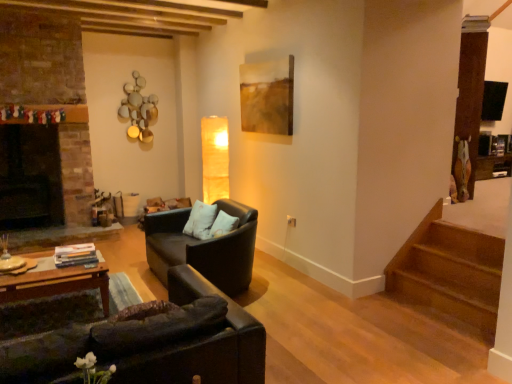
What are the coordinates of `matte black couch at center, positioned as the 1th studio couch in back-to-front order` in the screenshot? It's located at (204, 247).

In order to face matte black couch at center, positioned as the 1th studio couch in back-to-front order, should I rotate leftwards or rightwards?

It's best to rotate left around 7.034 degrees.

In order to face wooden coffee table at lower left, should I rotate leftwards or rightwards?

To face it directly, rotate left by 25.501 degrees.

Measure the distance between point (262, 85) and camera.

14.80 feet.

The height and width of the screenshot is (384, 512). Describe the element at coordinates (200, 220) in the screenshot. I see `white soft pillow at center` at that location.

The image size is (512, 384). I want to click on white soft pillow at center, so click(200, 220).

What are the coordinates of `matte black couch at center, the second studio couch viewed from the front` in the screenshot? It's located at (204, 247).

Is matte brown painting at upper center outside of white soft pillow at center?

Yes, matte brown painting at upper center is outside of white soft pillow at center.

Consider the image. Considering the relative sizes of matte brown painting at upper center and white soft pillow at center in the image provided, is matte brown painting at upper center thinner than white soft pillow at center?

Indeed, matte brown painting at upper center has a lesser width compared to white soft pillow at center.

Based on the photo, from a real-world perspective, is matte brown painting at upper center physically above white soft pillow at center?

Yes, from a real-world perspective, matte brown painting at upper center is over white soft pillow at center

Looking at this image, considering the relative positions of matte brown painting at upper center and white soft pillow at center in the image provided, is matte brown painting at upper center to the right of white soft pillow at center from the viewer's perspective?

Yes, matte brown painting at upper center is to the right of white soft pillow at center.

From the picture: From the image's perspective, is matte brown painting at upper center over black leather couch at lower left, marked as the 2th studio couch in a back-to-front arrangement?

Yes, from the image's perspective, matte brown painting at upper center is on top of black leather couch at lower left, marked as the 2th studio couch in a back-to-front arrangement.

Is the surface of matte brown painting at upper center in direct contact with black leather couch at lower left, marked as the 2th studio couch in a back-to-front arrangement?

No, matte brown painting at upper center is not in contact with black leather couch at lower left, marked as the 2th studio couch in a back-to-front arrangement.

Is matte brown painting at upper center bigger than black leather couch at lower left, marked as the 2th studio couch in a back-to-front arrangement?

No, matte brown painting at upper center is not bigger than black leather couch at lower left, marked as the 2th studio couch in a back-to-front arrangement.

Looking at this image, considering the relative sizes of matte black couch at center, the second studio couch viewed from the front, and matte brown painting at upper center in the image provided, is matte black couch at center, the second studio couch viewed from the front, wider than matte brown painting at upper center?

Correct, the width of matte black couch at center, the second studio couch viewed from the front, exceeds that of matte brown painting at upper center.

From a real-world perspective, which is physically above, matte black couch at center, positioned as the 1th studio couch in back-to-front order, or matte brown painting at upper center?

matte brown painting at upper center.

Is point (166, 234) in front of point (290, 102)?

Yes, point (166, 234) is closer to viewer.

Considering the relative positions of matte black couch at center, the second studio couch viewed from the front, and matte brown painting at upper center in the image provided, is matte black couch at center, the second studio couch viewed from the front, to the right of matte brown painting at upper center from the viewer's perspective?

No, matte black couch at center, the second studio couch viewed from the front, is not to the right of matte brown painting at upper center.

Identify the location of picture frame that appears above the white soft pillow at center (from the image's perspective). The width and height of the screenshot is (512, 384). (267, 96).

Visually, is white soft pillow at center positioned to the left or to the right of matte brown painting at upper center?

white soft pillow at center is positioned on matte brown painting at upper center's left side.

Is white soft pillow at center shorter than matte brown painting at upper center?

Yes, white soft pillow at center is shorter than matte brown painting at upper center.

From the image's perspective, is white soft pillow at center located above or below matte brown painting at upper center?

Based on their image positions, white soft pillow at center is located beneath matte brown painting at upper center.

Is wooden coffee table at lower left bigger than black leather couch at lower left, marked as the 2th studio couch in a back-to-front arrangement?

Actually, wooden coffee table at lower left might be smaller than black leather couch at lower left, marked as the 2th studio couch in a back-to-front arrangement.

From a real-world perspective, is wooden coffee table at lower left physically above black leather couch at lower left, which ranks as the first studio couch in front-to-back order?

No, from a real-world perspective, wooden coffee table at lower left is not over black leather couch at lower left, which ranks as the first studio couch in front-to-back order

Could you tell me if wooden coffee table at lower left is facing black leather couch at lower left, marked as the 2th studio couch in a back-to-front arrangement?

No, wooden coffee table at lower left is not turned towards black leather couch at lower left, marked as the 2th studio couch in a back-to-front arrangement.

How many degrees apart are the facing directions of wooden coffee table at lower left and black leather couch at lower left, marked as the 2th studio couch in a back-to-front arrangement?

2.04 degrees.

In the scene shown: From the image's perspective, who appears lower, wooden coffee table at lower left or matte black couch at center, the second studio couch viewed from the front?

wooden coffee table at lower left appears lower in the image.

Considering the relative sizes of wooden coffee table at lower left and matte black couch at center, the second studio couch viewed from the front, in the image provided, is wooden coffee table at lower left taller than matte black couch at center, the second studio couch viewed from the front,?

No.

Which is farther from the camera, (5, 286) or (179, 225)?

The point (179, 225) is farther from the camera.

Does wooden coffee table at lower left touch matte black couch at center, positioned as the 1th studio couch in back-to-front order?

No, wooden coffee table at lower left is not touching matte black couch at center, positioned as the 1th studio couch in back-to-front order.

Considering the positions of objects white soft pillow at center and wooden coffee table at lower left in the image provided, who is more to the left, white soft pillow at center or wooden coffee table at lower left?

From the viewer's perspective, wooden coffee table at lower left appears more on the left side.

Considering the sizes of objects white soft pillow at center and wooden coffee table at lower left in the image provided, who is smaller, white soft pillow at center or wooden coffee table at lower left?

Smaller between the two is white soft pillow at center.

Consider the image. Is white soft pillow at center inside or outside of wooden coffee table at lower left?

white soft pillow at center is spatially situated outside wooden coffee table at lower left.

From a real-world perspective, which object stands above the other?

In real-world perspective, white soft pillow at center is above.

Identify the location of picture frame above the white soft pillow at center (from a real-world perspective). The width and height of the screenshot is (512, 384). (267, 96).

This screenshot has width=512, height=384. What are the coordinates of `studio couch that is the 2nd one when counting forward from the matte brown painting at upper center` in the screenshot? It's located at (152, 343).

From the image, which object appears to be nearer to white soft pillow at center, matte black couch at center, positioned as the 1th studio couch in back-to-front order, or wooden coffee table at lower left?

matte black couch at center, positioned as the 1th studio couch in back-to-front order, is positioned closer to the anchor white soft pillow at center.

Considering their positions, is wooden coffee table at lower left positioned further to black leather couch at lower left, which ranks as the first studio couch in front-to-back order, than matte black couch at center, the second studio couch viewed from the front?

The object further to black leather couch at lower left, which ranks as the first studio couch in front-to-back order, is matte black couch at center, the second studio couch viewed from the front.

Which object lies nearer to the anchor point matte black couch at center, positioned as the 1th studio couch in back-to-front order, white soft pillow at center or matte brown painting at upper center?

white soft pillow at center lies closer to matte black couch at center, positioned as the 1th studio couch in back-to-front order, than the other object.

Considering their positions, is white soft pillow at center positioned further to matte brown painting at upper center than black leather couch at lower left, which ranks as the first studio couch in front-to-back order?

black leather couch at lower left, which ranks as the first studio couch in front-to-back order, is positioned further to the anchor matte brown painting at upper center.

Considering their positions, is white soft pillow at center positioned closer to wooden coffee table at lower left than matte black couch at center, positioned as the 1th studio couch in back-to-front order?

matte black couch at center, positioned as the 1th studio couch in back-to-front order, is closer to wooden coffee table at lower left.

Estimate the real-world distances between objects in this image. Which object is further from matte brown painting at upper center, matte black couch at center, the second studio couch viewed from the front, or wooden coffee table at lower left?

wooden coffee table at lower left lies further to matte brown painting at upper center than the other object.

When comparing their distances from black leather couch at lower left, marked as the 2th studio couch in a back-to-front arrangement, does matte brown painting at upper center or wooden coffee table at lower left seem further?

matte brown painting at upper center.

Based on their spatial positions, is wooden coffee table at lower left or black leather couch at lower left, marked as the 2th studio couch in a back-to-front arrangement, closer to matte brown painting at upper center?

The object closer to matte brown painting at upper center is wooden coffee table at lower left.

You are a GUI agent. You are given a task and a screenshot of the screen. Output one action in this format:
    pyautogui.click(x=<x>, y=<y>)
    Task: Click on the table located between black leather couch at lower left, which ranks as the first studio couch in front-to-back order, and white soft pillow at center in the depth direction
    This screenshot has width=512, height=384.
    Given the screenshot: What is the action you would take?
    pyautogui.click(x=56, y=282)

I want to click on studio couch between black leather couch at lower left, which ranks as the first studio couch in front-to-back order, and white soft pillow at center, along the z-axis, so click(204, 247).

The width and height of the screenshot is (512, 384). I want to click on studio couch between matte brown painting at upper center and wooden coffee table at lower left in the vertical direction, so pyautogui.click(x=204, y=247).

Locate an element on the screen. pillow between wooden coffee table at lower left and matte black couch at center, the second studio couch viewed from the front, in the horizontal direction is located at coordinates (200, 220).